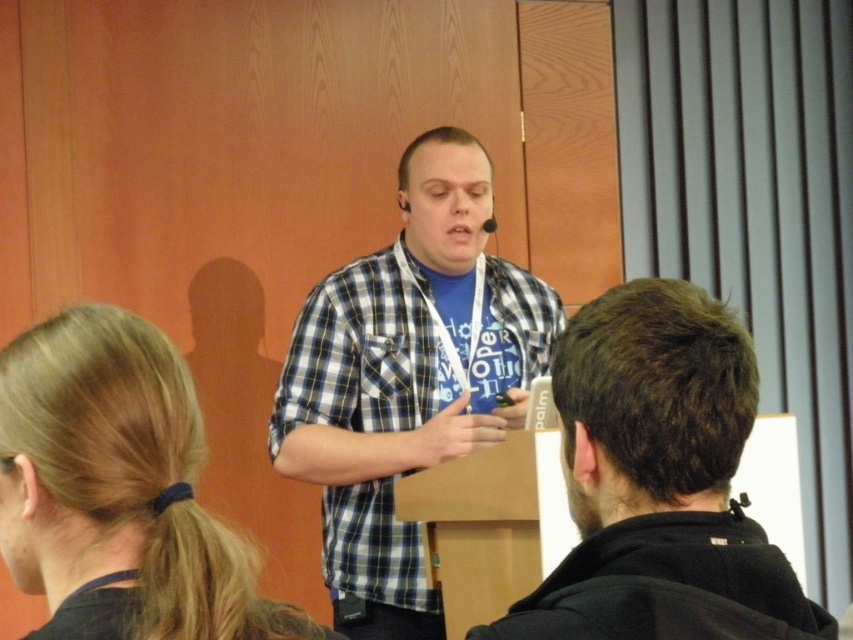
Who is more distant from viewer, (x=466, y=385) or (x=602, y=554)?

Point (x=466, y=385)

Which of these two, checkered fabric shirt at center or black cotton shirt at center, stands shorter?

black cotton shirt at center is shorter.

Is point (381, 456) behind point (682, 589)?

Yes, point (381, 456) is behind point (682, 589).

Identify the location of checkered fabric shirt at center. (407, 380).

Identify the location of black cotton shirt at center. (659, 481).

Locate an element on the screen. The width and height of the screenshot is (853, 640). black cotton shirt at center is located at coordinates (659, 481).

Looking at this image, is checkered fabric shirt at center further to the viewer compared to blonde hair at lower left?

Yes, checkered fabric shirt at center is further from the viewer.

Locate an element on the screen. checkered fabric shirt at center is located at coordinates (407, 380).

This screenshot has width=853, height=640. What do you see at coordinates (407, 380) in the screenshot?
I see `checkered fabric shirt at center` at bounding box center [407, 380].

Identify the location of checkered fabric shirt at center. (407, 380).